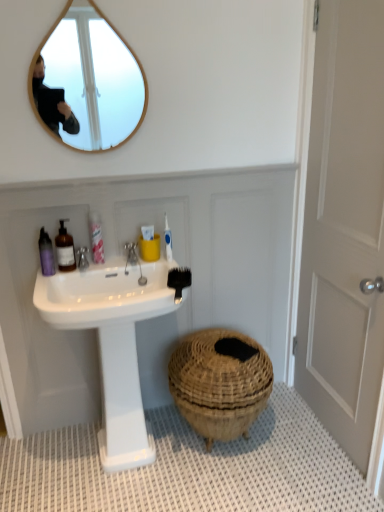
At what (x,y) coordinates should I click in order to perform the action: click on free region on the left part of white matte door at right. Please return your answer as a coordinate pair (x, y). This screenshot has width=384, height=512. Looking at the image, I should click on (274, 444).